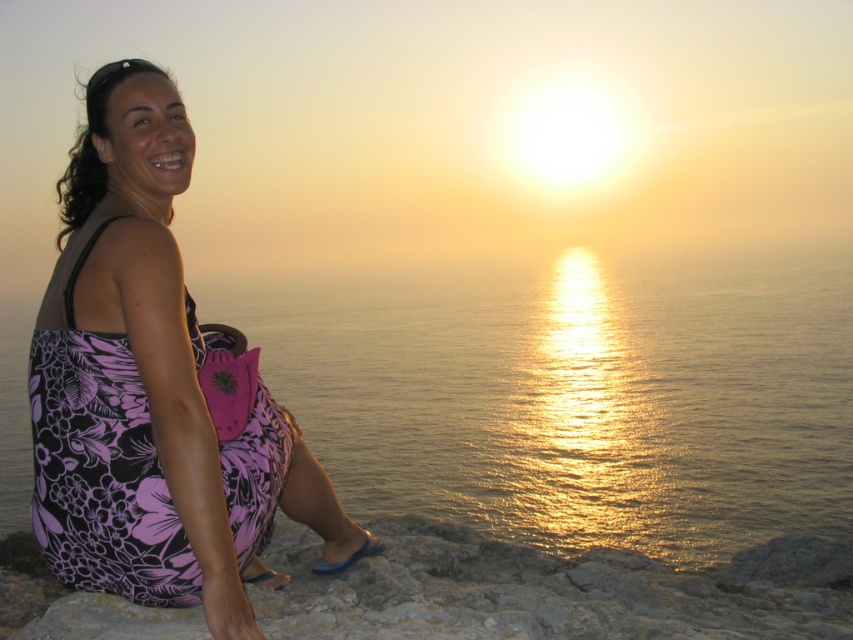
You are a photographer trying to capture the sunset scene. You want to ensure that the golden reflective water at center and the floral dress at left are both visible in your shot. Given that the camera frame can only accommodate objects with a combined width of up to 1.5 meters, will you be able to fit both objects within the frame?

The golden reflective water at center has a larger width than the floral dress at left. Since the combined width of both objects must be under 1.5 meters, but we don not have exact measurements, it is uncertain if they will fit. However, since the water is wider, it might take up more space, possibly exceeding the limit. Further information on their individual widths is needed to determine this accurately.

You are a photographer trying to capture the sunset scene. You notice the golden reflective water at center and the floral dress at left in your viewfinder. Based on their heights in the image, which one would appear taller in the photo?

The golden reflective water at center appears taller than the floral dress at left in the photo because it has a greater height compared to the floral dress at left.